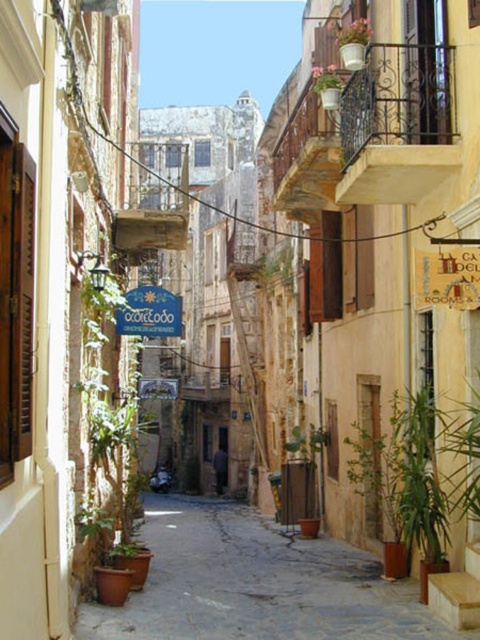
Question: Which point is closer to the camera?

Choices:
 (A) green leafy plant at left
 (B) green matte plant at center
 (C) pink matte flower pot at upper center
 (D) blue painted wood sign at center

Answer: (A)

Question: Is wooden signboard at center to the right of pink matte flower pot at upper center from the viewer's perspective?

Choices:
 (A) no
 (B) yes

Answer: (B)

Question: Is smooth stone alley at lower left to the right of wooden signboard at center from the viewer's perspective?

Choices:
 (A) no
 (B) yes

Answer: (A)

Question: Which object is farther from the camera taking this photo?

Choices:
 (A) blue painted wood sign at center
 (B) green matte plant at center

Answer: (B)

Question: Among these objects, which one is farthest from the camera?

Choices:
 (A) green matte plant at center
 (B) pink matte flower pot at upper center

Answer: (A)

Question: Does smooth stone alley at lower left come in front of green leafy plant at lower right?

Choices:
 (A) yes
 (B) no

Answer: (A)